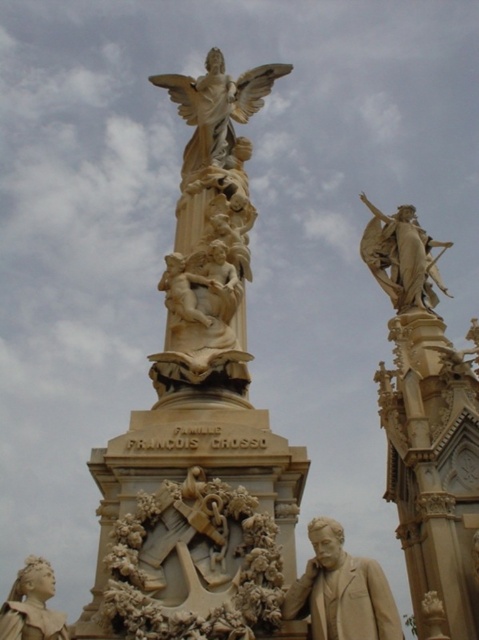
From the picture: Is matte gold statue at upper right positioned at the back of golden polished statue at upper right?

No, matte gold statue at upper right is in front of golden polished statue at upper right.

Does point (447, 397) lie behind point (423, 241)?

No.

Find the location of a particular element. The image size is (479, 640). matte gold statue at upper right is located at coordinates 426,428.

Can you confirm if beige stone statue at lower center is shorter than golden polished statue at upper right?

Indeed, beige stone statue at lower center has a lesser height compared to golden polished statue at upper right.

Which is below, beige stone statue at lower center or golden polished statue at upper right?

Positioned lower is beige stone statue at lower center.

The height and width of the screenshot is (640, 479). Identify the location of beige stone statue at lower center. (342, 589).

At what (x,y) coordinates should I click in order to perform the action: click on beige stone statue at lower center. Please return your answer as a coordinate pair (x, y). Looking at the image, I should click on (342, 589).

Between matte gold statue at upper right and beige stone statue at lower center, which one is positioned higher?

beige stone statue at lower center is higher up.

Does matte gold statue at upper right have a greater height compared to beige stone statue at lower center?

Correct, matte gold statue at upper right is much taller as beige stone statue at lower center.

Does point (386, 289) come farther from viewer compared to point (372, 605)?

Yes, point (386, 289) is farther from viewer.

Image resolution: width=479 pixels, height=640 pixels. I want to click on matte gold statue at upper right, so click(x=426, y=428).